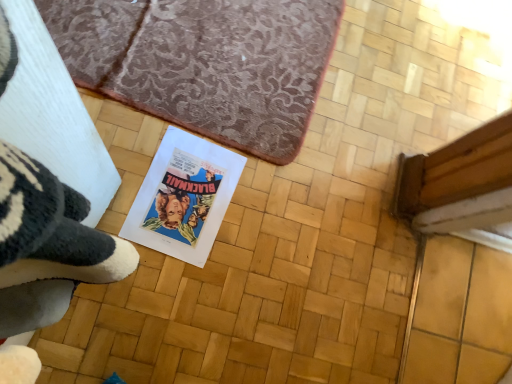
Locate an element on the screen. vacant space situated on the left part of matte paper book at center is located at coordinates (139, 122).